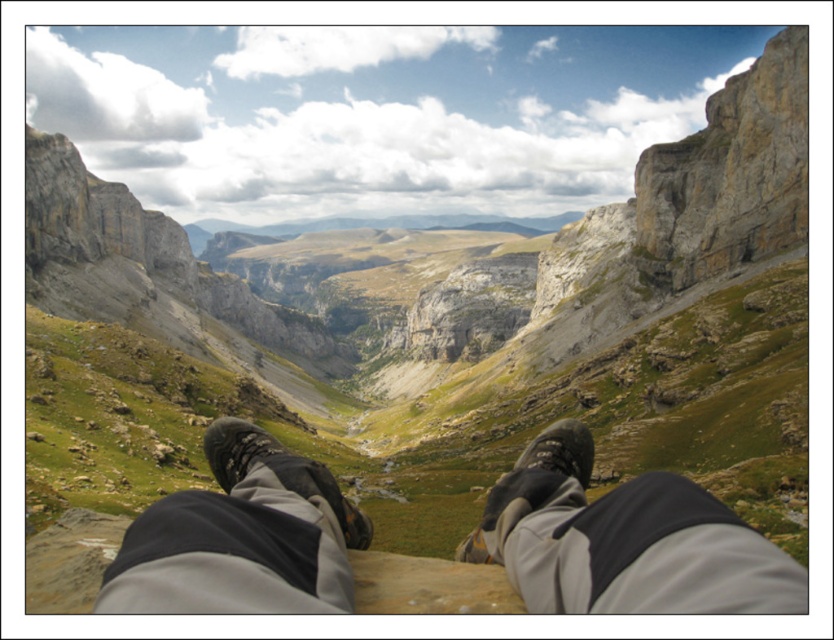
Does gray fabric pants at lower center have a smaller size compared to black suede boot at lower center?

Correct, gray fabric pants at lower center occupies less space than black suede boot at lower center.

Which is more to the right, gray fabric pants at lower center or black suede boot at lower center?

gray fabric pants at lower center is more to the right.

Where is `gray fabric pants at lower center`? gray fabric pants at lower center is located at coordinates (624, 540).

Is matte gray boot at center above black suede boot at lower center?

No, matte gray boot at center is not above black suede boot at lower center.

Is matte gray boot at center to the left of black suede boot at lower center from the viewer's perspective?

In fact, matte gray boot at center is to the right of black suede boot at lower center.

Between point (561, 442) and point (245, 456), which one is positioned behind?

Point (561, 442)

Locate an element on the screen. The width and height of the screenshot is (834, 640). matte gray boot at center is located at coordinates (530, 484).

Does gray fabric pants at lower center have a greater height compared to matte gray boot at center?

In fact, gray fabric pants at lower center may be shorter than matte gray boot at center.

Is gray fabric pants at lower center closer to the viewer compared to matte gray boot at center?

Yes, it is in front of matte gray boot at center.

Where is `gray fabric pants at lower center`? gray fabric pants at lower center is located at coordinates (624, 540).